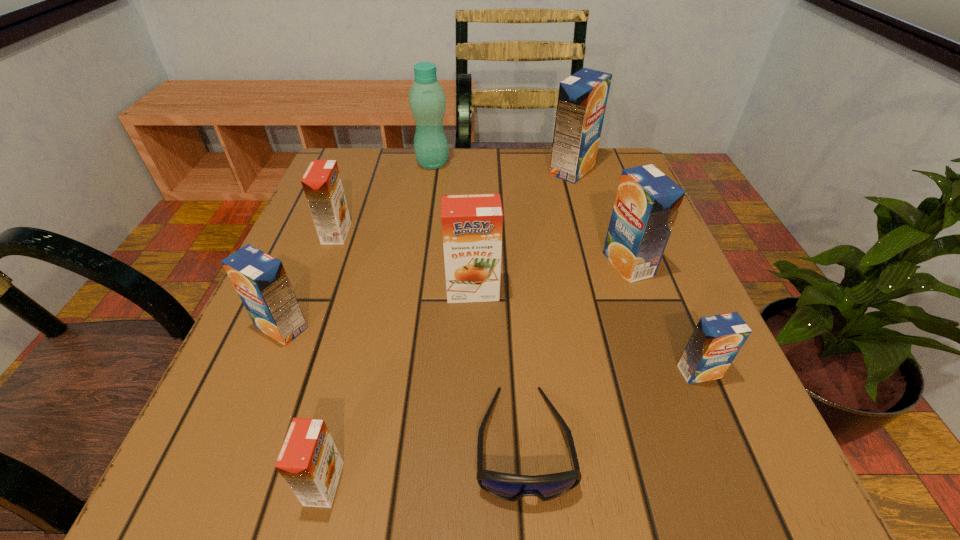
Where is `the third nearest object`? the third nearest object is located at coordinates (716, 340).

Find the location of `the nearest blue orange_juice`. the nearest blue orange_juice is located at coordinates (716, 340).

Identify the location of the second orange orange juice from left to right. The image size is (960, 540). (309, 461).

Image resolution: width=960 pixels, height=540 pixels. Find the location of `the third object from left to right`. the third object from left to right is located at coordinates [309, 461].

Locate an element on the screen. blue sunglasses is located at coordinates (512, 487).

I want to click on sunglasses, so click(512, 487).

Locate an element on the screen. The width and height of the screenshot is (960, 540). free location located on the right of the bottle is located at coordinates (494, 163).

You are a GUI agent. You are given a task and a screenshot of the screen. Output one action in this format:
    pyautogui.click(x=<x>, y=<y>)
    Task: Click on the blank area located 0.080m on the front of the farthest orange juice
    
    Given the screenshot: What is the action you would take?
    pyautogui.click(x=582, y=204)

You are a GUI agent. You are given a task and a screenshot of the screen. Output one action in this format:
    pyautogui.click(x=<x>, y=<y>)
    Task: Click on the vacant region located 0.130m on the right of the rightmost orange orange juice
    The image size is (960, 540).
    Given the screenshot: What is the action you would take?
    tap(574, 291)

The image size is (960, 540). Identify the location of vacant point located 0.110m on the left of the third smallest blue orange_juice. (546, 264).